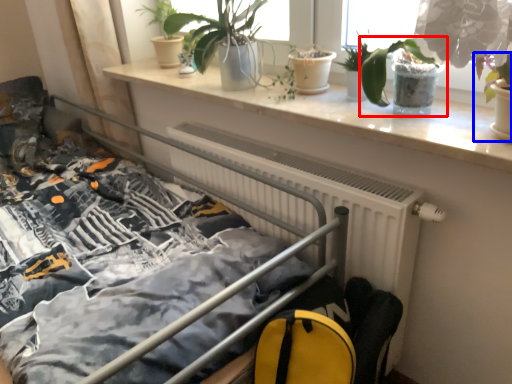
Question: Which of the following is the farthest to the observer, houseplant (highlighted by a red box) or houseplant (highlighted by a blue box)?

Choices:
 (A) houseplant
 (B) houseplant

Answer: (A)